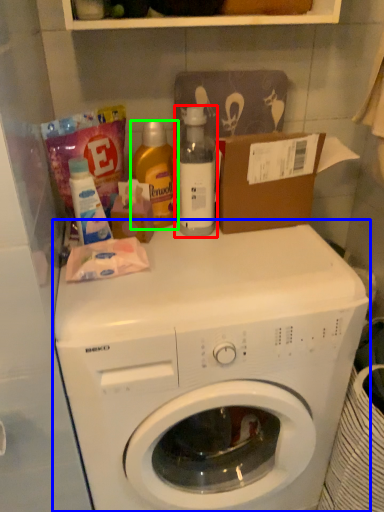
Question: Considering the real-world distances, which object is closest to bottle (highlighted by a red box)? washing machine (highlighted by a blue box) or cleaning product (highlighted by a green box).

Choices:
 (A) washing machine
 (B) cleaning product

Answer: (B)